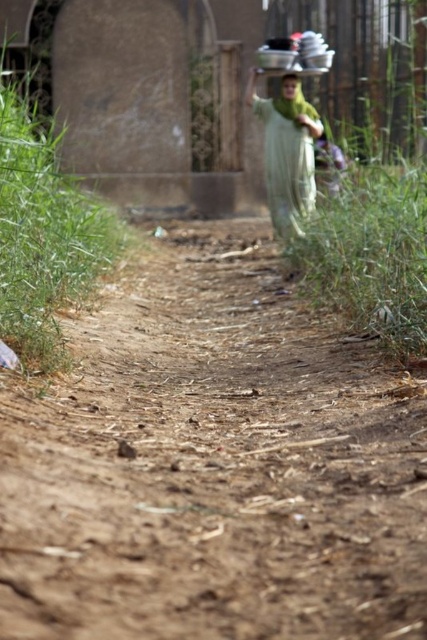
You are a hiker who has stumbled upon this rural path. You notice two green fabric items in the scene. Which one is taller, the green fabric at center or the green fabric head at upper center?

The green fabric at center is taller than the green fabric head at upper center.

You are a hiker trying to follow the path in the image. The brown dirt track at center and the green fabric head at upper center are both visible. Which object is located to the left of the other?

The brown dirt track at center is to the left of the green fabric head at upper center.